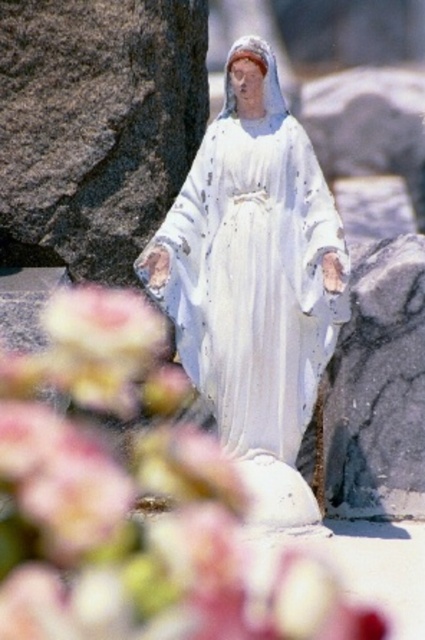
Based on the photo, you are a photographer trying to capture the white glossy statue at center and the blurred floral petals at center in a single frame. Based on their positions, which object should you focus on first to ensure both are in the shot?

The blurred floral petals at center are to the left of the white glossy statue at center. To ensure both are in the shot, focus on the white glossy statue at center first since it is the central subject and the petals are nearby.

You are an artist planning to paint the scene. You have to decide which object to focus on first based on their sizes. Which one should you focus on first, the blurred floral petals at center or the white glossy statue at center?

The blurred floral petals at center has a larger size compared to the white glossy statue at center, so you should focus on the blurred floral petals at center first to capture their scale accurately before moving to the smaller statue.